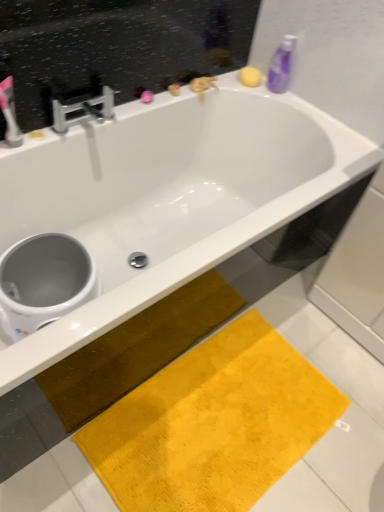
Find the location of a particular element. This screenshot has width=384, height=512. blank space situated above yellow plush bath mat at lower center (from a real-world perspective) is located at coordinates (227, 414).